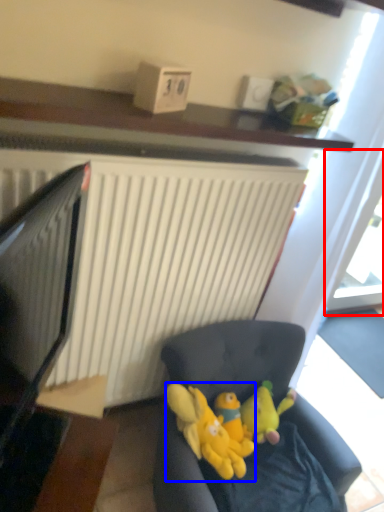
Question: Which object is closer to the camera taking this photo, glass door (highlighted by a red box) or toy (highlighted by a blue box)?

Choices:
 (A) glass door
 (B) toy

Answer: (B)